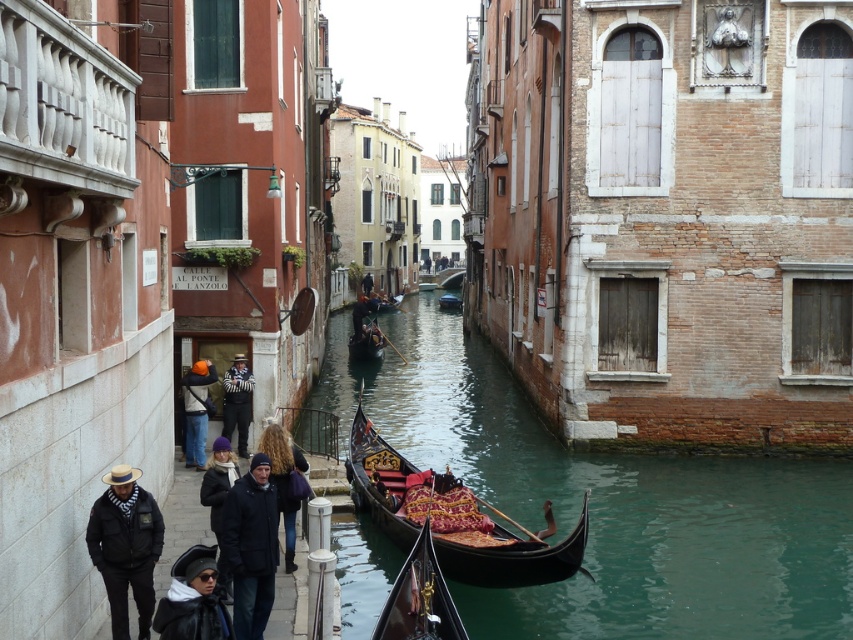
Question: Is dark gray knit hat at lower center positioned in front of striped sweater at center?

Choices:
 (A) yes
 (B) no

Answer: (A)

Question: Based on their relative distances, which object is nearer to the wooden gondola at center?

Choices:
 (A) smooth dark wood gondola at center
 (B) dark gray knit hat at lower center

Answer: (A)

Question: Estimate the real-world distances between objects in this image. Which object is farther from the smooth dark wood gondola at center?

Choices:
 (A) dark brown leather jacket at center
 (B) wooden gondola at center
 (C) dark gray knit hat at lower center
 (D) black leather coat at lower left

Answer: (B)

Question: Can you confirm if black leather coat at lower left is positioned above orange helmet at center?

Choices:
 (A) yes
 (B) no

Answer: (B)

Question: Does smooth dark wood gondola at center lie in front of black woolen hat at lower center?

Choices:
 (A) yes
 (B) no

Answer: (B)

Question: Which object is the farthest from the black polished gondola at center?

Choices:
 (A) black matte jacket at lower left
 (B) black leather coat at lower left
 (C) dark brown leather jacket at center

Answer: (B)